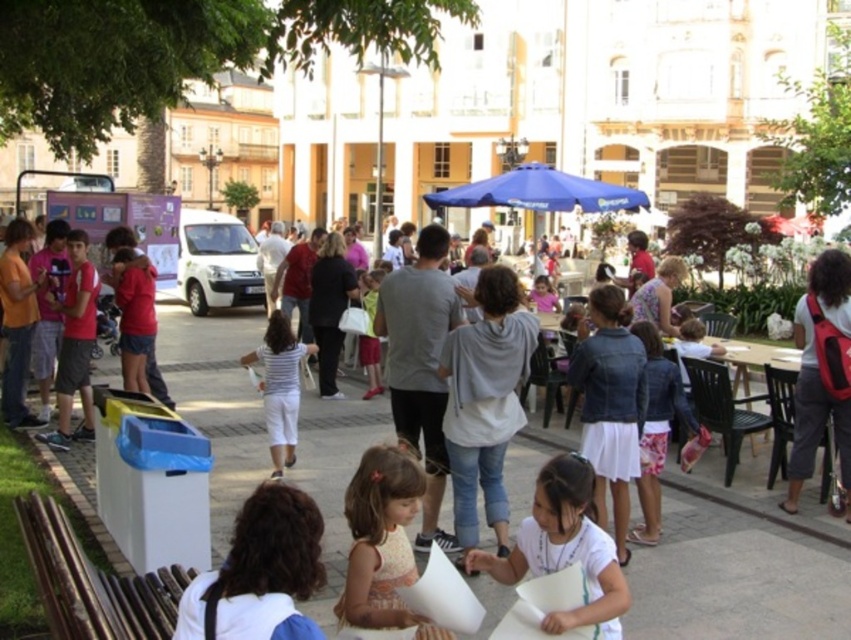
Find the location of a particular element. This screenshot has width=851, height=640. light brown fabric dress at center is located at coordinates (381, 545).

Is light brown fabric dress at center to the right of blue fabric umbrella at center from the viewer's perspective?

No, light brown fabric dress at center is not to the right of blue fabric umbrella at center.

The image size is (851, 640). I want to click on light brown fabric dress at center, so click(x=381, y=545).

Is point (790, 609) farther from camera compared to point (352, 513)?

Yes, it is behind point (352, 513).

Between brown wooden bench at lower left and light brown fabric dress at center, which one is positioned higher?

brown wooden bench at lower left is above.

At what (x,y) coordinates should I click in order to perform the action: click on brown wooden bench at lower left. Please return your answer as a coordinate pair (x, y). The height and width of the screenshot is (640, 851). Looking at the image, I should click on (735, 579).

This screenshot has height=640, width=851. I want to click on brown wooden bench at lower left, so click(735, 579).

From the picture: Can you confirm if brown wooden bench at lower left is wider than blue fabric umbrella at center?

Correct, the width of brown wooden bench at lower left exceeds that of blue fabric umbrella at center.

Who is lower down, brown wooden bench at lower left or blue fabric umbrella at center?

brown wooden bench at lower left is below.

Which is behind, point (363, 436) or point (478, 186)?

The point (478, 186) is behind.

What are the coordinates of `brown wooden bench at lower left` in the screenshot? It's located at (735, 579).